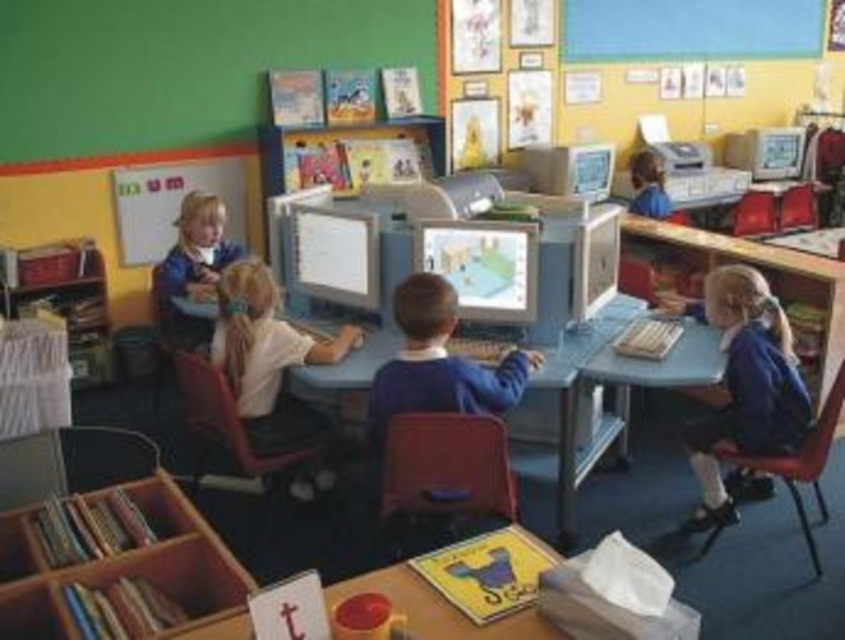
Who is taller, white glossy monitor at center or blue fabric jacket at upper right?

blue fabric jacket at upper right

Does white glossy monitor at center appear over blue fabric jacket at upper right?

No.

Who is more forward, (330, 225) or (658, 204)?

Point (330, 225) is more forward.

The width and height of the screenshot is (845, 640). I want to click on white glossy monitor at center, so click(x=335, y=253).

Which is more to the right, wooden bookshelf at left or blue fabric jacket at upper right?

Positioned to the right is blue fabric jacket at upper right.

Is wooden bookshelf at left positioned at the back of blue fabric jacket at upper right?

No, wooden bookshelf at left is in front of blue fabric jacket at upper right.

Is point (52, 298) farther from camera compared to point (650, 154)?

No, (52, 298) is in front of (650, 154).

Locate an element on the screen. The image size is (845, 640). wooden bookshelf at left is located at coordinates (63, 298).

Can you confirm if wooden bookshelf at lower left is taller than white matte chalkboard at upper left?

No.

Which is in front, point (178, 536) or point (172, 164)?

Point (178, 536) is more forward.

Is point (83, 557) more distant than point (232, 198)?

No, it is in front of (232, 198).

At what (x,y) coordinates should I click in order to perform the action: click on wooden bookshelf at lower left. Please return your answer as a coordinate pair (x, y). This screenshot has width=845, height=640. Looking at the image, I should click on (113, 564).